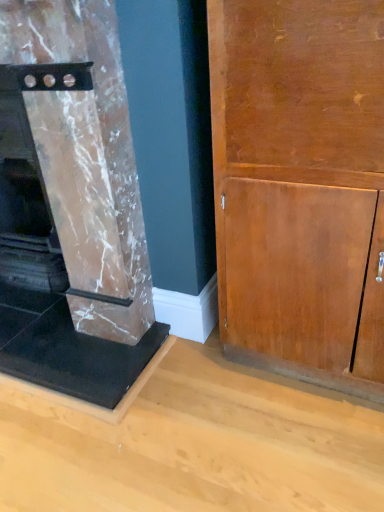
Question: From a real-world perspective, is wooden cabinet at right above or below marble fireplace at left?

Choices:
 (A) below
 (B) above

Answer: (A)

Question: Is wooden cabinet at right wider or thinner than marble fireplace at left?

Choices:
 (A) thin
 (B) wide

Answer: (A)

Question: In the image, is wooden cabinet at right positioned in front of or behind marble fireplace at left?

Choices:
 (A) behind
 (B) front

Answer: (B)

Question: Considering the positions of point (71, 131) and point (347, 211), is point (71, 131) closer or farther from the camera than point (347, 211)?

Choices:
 (A) farther
 (B) closer

Answer: (A)

Question: In the image, is marble fireplace at left on the left side or the right side of wooden cabinet at right?

Choices:
 (A) left
 (B) right

Answer: (A)

Question: From a real-world perspective, relative to wooden cabinet at right, is marble fireplace at left vertically above or below?

Choices:
 (A) above
 (B) below

Answer: (A)

Question: Considering the positions of marble fireplace at left and wooden cabinet at right in the image, is marble fireplace at left wider or thinner than wooden cabinet at right?

Choices:
 (A) wide
 (B) thin

Answer: (A)